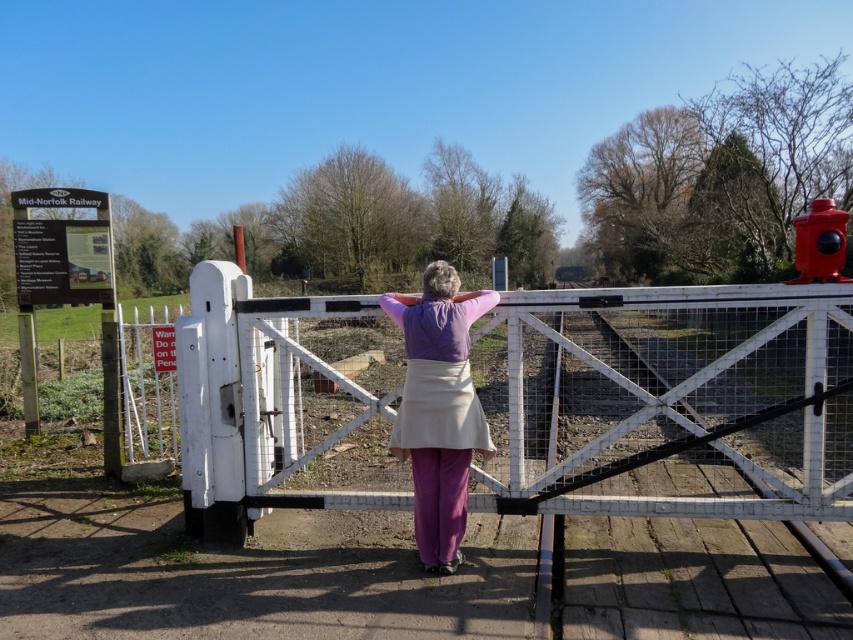
Question: Is purple matte shirt at center above shiny red hydrant at upper right?

Choices:
 (A) yes
 (B) no

Answer: (B)

Question: Can you confirm if purple matte shirt at center is wider than shiny red hydrant at upper right?

Choices:
 (A) no
 (B) yes

Answer: (A)

Question: Which point is farther to the camera?

Choices:
 (A) (811, 218)
 (B) (440, 417)

Answer: (A)

Question: Which object appears closest to the camera in this image?

Choices:
 (A) shiny red hydrant at upper right
 (B) purple matte shirt at center

Answer: (A)

Question: Does purple matte shirt at center come behind shiny red hydrant at upper right?

Choices:
 (A) no
 (B) yes

Answer: (B)